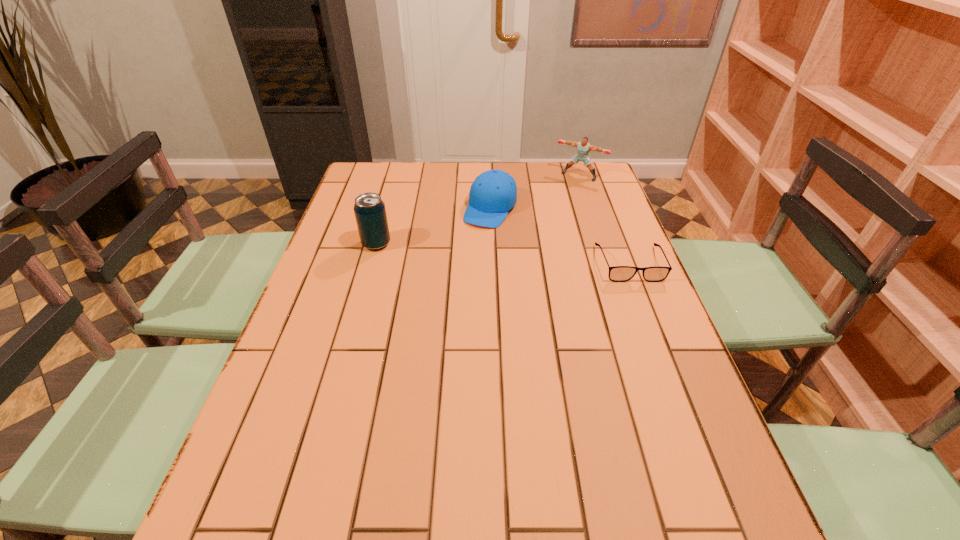
Identify the location of free space located on the front-facing side of the second farthest object. This screenshot has width=960, height=540. (445, 287).

At what (x,y) coordinates should I click in order to perform the action: click on blank space located on the front-facing side of the second farthest object. Please return your answer as a coordinate pair (x, y). Image resolution: width=960 pixels, height=540 pixels. Looking at the image, I should click on (441, 294).

Identify the location of vacant space located 0.330m on the front-facing side of the second farthest object. The width and height of the screenshot is (960, 540). (438, 300).

Locate an element on the screen. This screenshot has height=540, width=960. puncher that is positioned at the far edge is located at coordinates (584, 147).

I want to click on cap that is at the far edge, so click(x=493, y=193).

You are a GUI agent. You are given a task and a screenshot of the screen. Output one action in this format:
    pyautogui.click(x=<x>, y=<y>)
    Task: Click on the object located in the left edge section of the desktop
    Image resolution: width=960 pixels, height=540 pixels.
    Given the screenshot: What is the action you would take?
    pyautogui.click(x=369, y=209)

In order to click on spectacles present at the right edge in this screenshot , I will do `click(616, 273)`.

The width and height of the screenshot is (960, 540). I want to click on puncher that is at the right edge, so click(584, 147).

Where is `object located in the far right corner section of the desktop`? The width and height of the screenshot is (960, 540). object located in the far right corner section of the desktop is located at coordinates (584, 147).

I want to click on free space at the far edge, so click(543, 194).